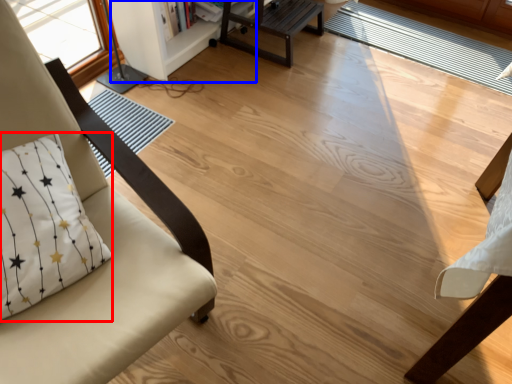
Question: Which of the following is the closest to the observer, pillow (highlighted by a red box) or bookshelf (highlighted by a blue box)?

Choices:
 (A) pillow
 (B) bookshelf

Answer: (A)